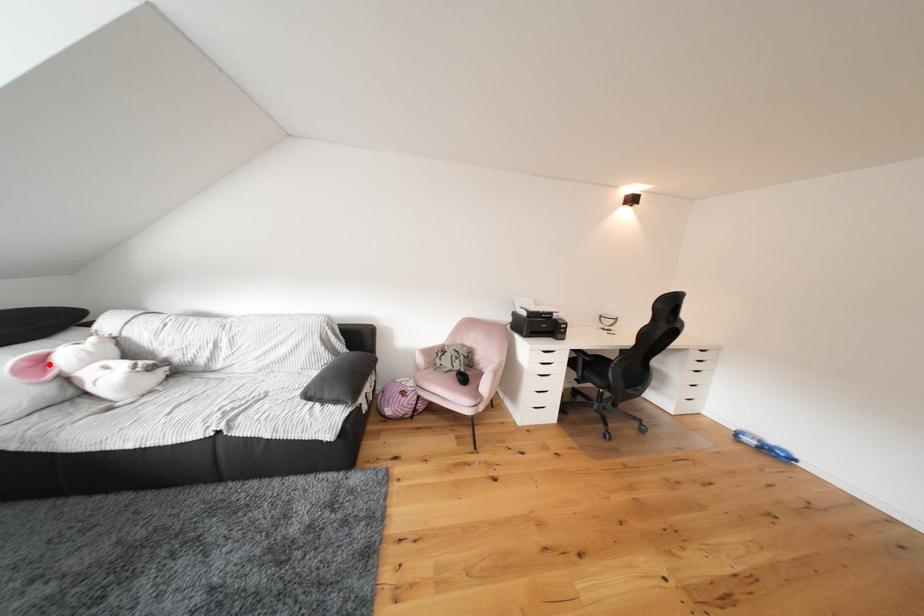
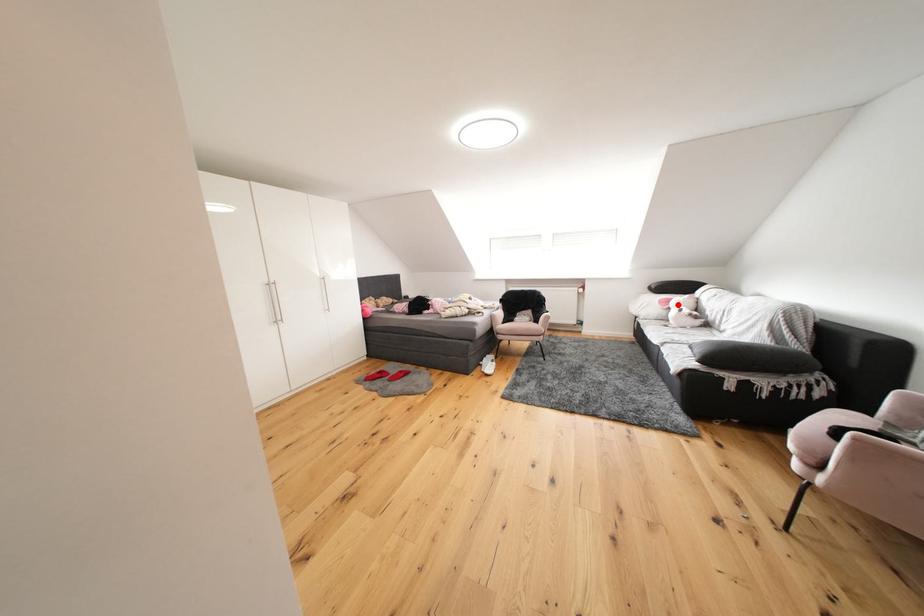
I am providing you with two images of the same scene from different viewpoints. A red point is marked on the first image and another point is marked on the second image. Is the red point in image1 aligned with the point shown in image2?

Yes